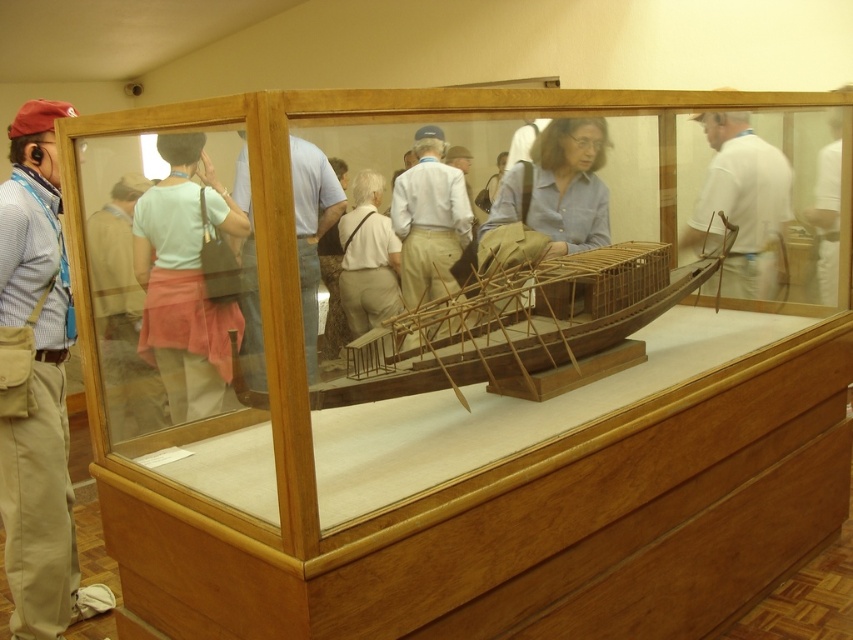
Describe the element at coordinates (38, 387) in the screenshot. This screenshot has height=640, width=853. I see `khaki pants at center` at that location.

Does point (24, 115) lie in front of point (537, 296)?

No.

Locate an element on the screen. khaki pants at center is located at coordinates (38, 387).

Is point (706, 186) more distant than point (815, 218)?

Yes, point (706, 186) is behind point (815, 218).

Is point (755, 138) farther from viewer compared to point (824, 186)?

Yes, point (755, 138) is farther from viewer.

Find the location of a particular element. white matte shirt at upper right is located at coordinates (741, 205).

Based on the photo, is matte brown shirt at center positioned behind light beige fabric at center?

No, matte brown shirt at center is in front of light beige fabric at center.

Which is behind, point (297, 161) or point (376, 202)?

The point (376, 202) is behind.

Locate an element on the screen. This screenshot has width=853, height=640. matte brown shirt at center is located at coordinates (312, 230).